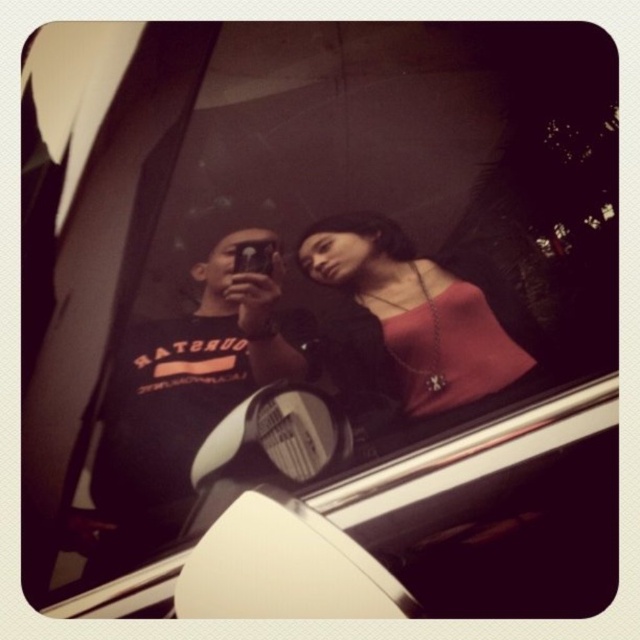
Is point (509, 349) farther from camera compared to point (304, 436)?

Yes, it is behind point (304, 436).

Is matte pink top at center thinner than white plastic view mirror at center?

In fact, matte pink top at center might be wider than white plastic view mirror at center.

Is point (408, 304) closer to camera compared to point (244, 404)?

No, it is not.

I want to click on matte pink top at center, so click(x=410, y=317).

Does black matte t-shirt at center appear under matte pink top at center?

Yes, black matte t-shirt at center is below matte pink top at center.

Who is taller, black matte t-shirt at center or matte pink top at center?

black matte t-shirt at center is taller.

What do you see at coordinates (177, 404) in the screenshot?
I see `black matte t-shirt at center` at bounding box center [177, 404].

Find the location of a particular element. The height and width of the screenshot is (640, 640). black matte t-shirt at center is located at coordinates (177, 404).

Who is lower down, black matte t-shirt at center or white plastic view mirror at center?

white plastic view mirror at center is below.

Does black matte t-shirt at center appear on the left side of white plastic view mirror at center?

Correct, you'll find black matte t-shirt at center to the left of white plastic view mirror at center.

Image resolution: width=640 pixels, height=640 pixels. I want to click on black matte t-shirt at center, so click(x=177, y=404).

You are a GUI agent. You are given a task and a screenshot of the screen. Output one action in this format:
    pyautogui.click(x=<x>, y=<y>)
    Task: Click on the black matte t-shirt at center
    The image size is (640, 640).
    Given the screenshot: What is the action you would take?
    pyautogui.click(x=177, y=404)